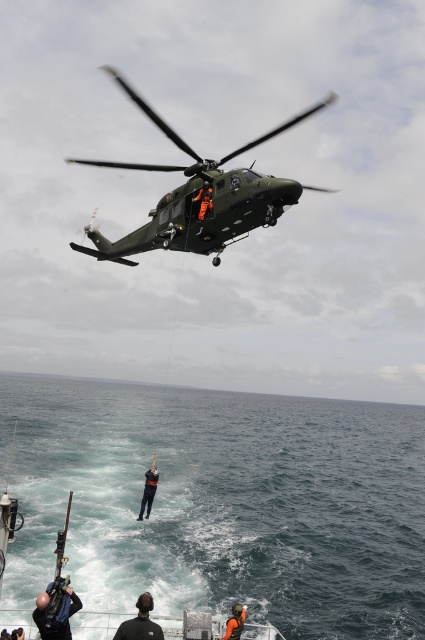
You are a rescue pilot flying a military helicopter and need to land on a nearby island. The coordinates of the landing zone are point (291, 435). Given that the minimum safe distance for landing is 50 meters, can you safely land at this point?

The distance of point (291, 435) from the viewer is 70.55 meters, which is greater than the minimum safe distance of 50 meters. Therefore, you can safely land at this point.

You are a pilot in the helicopter observing two points in the scene. The first point is labeled as point (138, 589) and the second is point (232, 628). Which point is closer to the helicopter?

Point (232, 628) is closer to the helicopter because it is less further to the camera than point (138, 589).